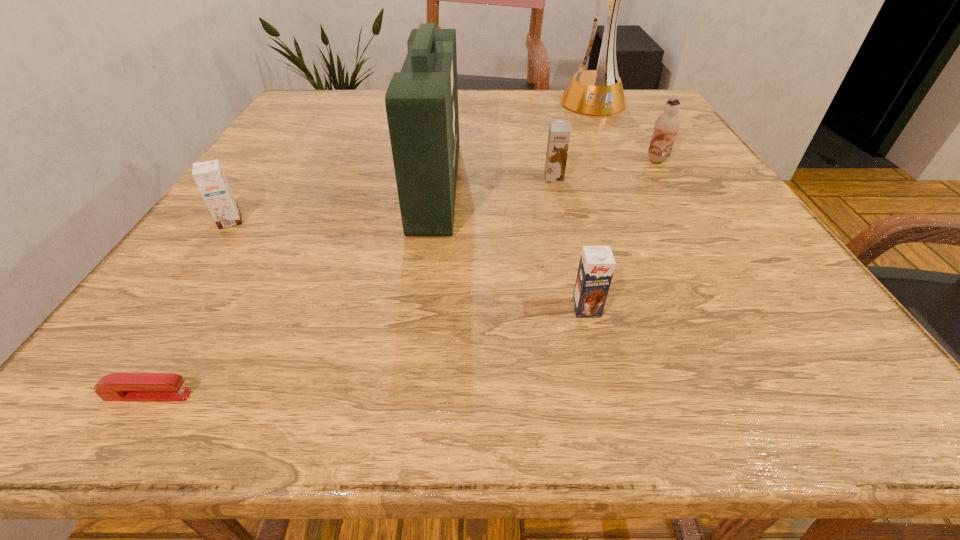
Identify the location of vacant area that lies between the third nearest chocolate milk and the shortest object. coord(350,287).

Locate which object ranks in proximity to the nearest chocolate milk. Please provide its 2D coordinates. Your answer should be formatted as a tuple, i.e. [(x, y)], where the tuple contains the x and y coordinates of a point satisfying the conditions above.

[(421, 101)]

You are a GUI agent. You are given a task and a screenshot of the screen. Output one action in this format:
    pyautogui.click(x=<x>, y=<y>)
    Task: Click on the object that stands as the third closest to the shortest object
    This screenshot has height=540, width=960.
    Given the screenshot: What is the action you would take?
    pyautogui.click(x=597, y=263)

Locate which chocolate milk ranks third in proximity to the rightmost chocolate milk. Please provide its 2D coordinates. Your answer should be formatted as a tuple, i.e. [(x, y)], where the tuple contains the x and y coordinates of a point satisfying the conditions above.

[(209, 176)]

Select which chocolate milk is the closest to the rightmost chocolate milk. Please provide its 2D coordinates. Your answer should be formatted as a tuple, i.e. [(x, y)], where the tuple contains the x and y coordinates of a point satisfying the conditions above.

[(559, 133)]

You are a GUI agent. You are given a task and a screenshot of the screen. Output one action in this format:
    pyautogui.click(x=<x>, y=<y>)
    Task: Click on the vacant space that satisfies the following two spatial constraints: 1. on the front-facing side of the farthest object; 2. on the front-facing side of the second tallest object
    This screenshot has height=540, width=960.
    Given the screenshot: What is the action you would take?
    pyautogui.click(x=630, y=184)

Identify the location of free space that satisfies the following two spatial constraints: 1. on the front-facing side of the farthest object; 2. on the front-facing side of the third object from left to right. (630, 184).

You are a GUI agent. You are given a task and a screenshot of the screen. Output one action in this format:
    pyautogui.click(x=<x>, y=<y>)
    Task: Click on the free space that satisfies the following two spatial constraints: 1. on the front label of the nearest chocolate milk; 2. on the front-facing side of the nearest object
    Image resolution: width=960 pixels, height=540 pixels.
    Given the screenshot: What is the action you would take?
    pyautogui.click(x=608, y=395)

Find the location of a particular element. The width and height of the screenshot is (960, 540). vacant region that satisfies the following two spatial constraints: 1. on the front-facing side of the farthest object; 2. on the front-facing side of the stapler is located at coordinates (729, 395).